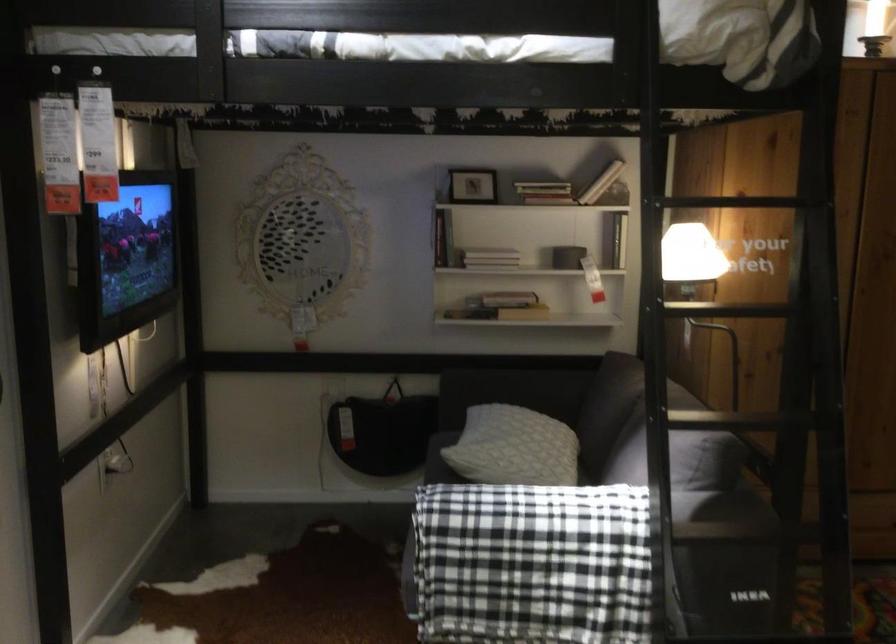
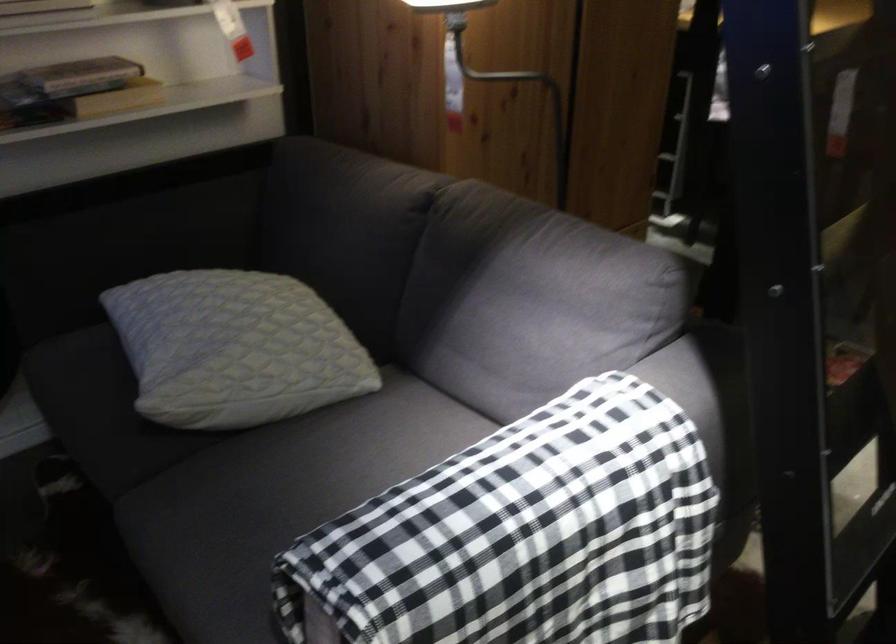
In the second image, find the point that corresponds to point 441,482 in the first image.

(131, 448)